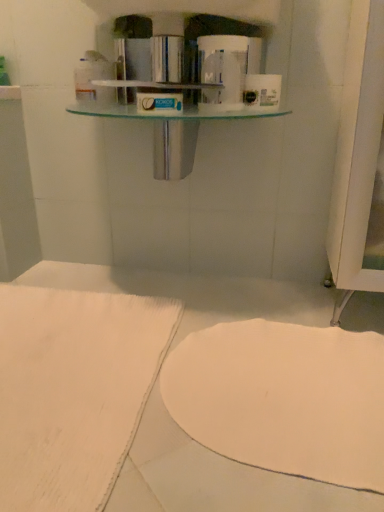
Question: Considering the positions of white fabric at lower left and white matte toilet paper at upper center, the 2th toilet paper in the left-to-right sequence, in the image, is white fabric at lower left bigger or smaller than white matte toilet paper at upper center, the 2th toilet paper in the left-to-right sequence,?

Choices:
 (A) big
 (B) small

Answer: (A)

Question: Considering the positions of point (148, 385) and point (264, 100), is point (148, 385) closer or farther from the camera than point (264, 100)?

Choices:
 (A) closer
 (B) farther

Answer: (A)

Question: Considering the real-world distances, which object is farthest from the white glossy toilet paper at upper center, which is the second toilet paper from right to left?

Choices:
 (A) white matte towel at lower center
 (B) white fabric at lower left
 (C) white matte toilet paper at upper center, the 1th toilet paper from the right

Answer: (B)

Question: Which object is positioned farthest from the white fabric at lower left?

Choices:
 (A) white glossy toilet paper at upper center, which is the second toilet paper from right to left
 (B) white matte toilet paper at upper center, the 1th toilet paper from the right
 (C) white matte towel at lower center

Answer: (B)